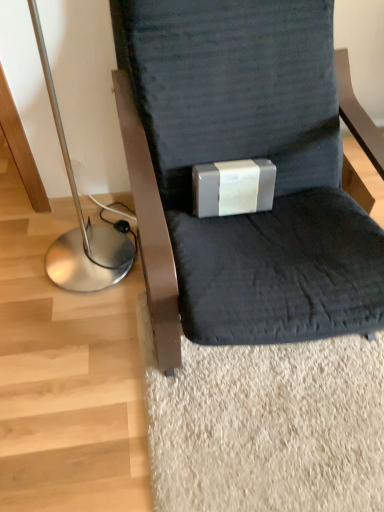
Question: Is matte gray box at center completely or partially outside of silver metallic floor lamp at left?

Choices:
 (A) no
 (B) yes

Answer: (B)

Question: From a real-world perspective, is matte gray box at center physically below silver metallic floor lamp at left?

Choices:
 (A) no
 (B) yes

Answer: (B)

Question: Does matte gray box at center lie in front of silver metallic floor lamp at left?

Choices:
 (A) yes
 (B) no

Answer: (B)

Question: Does matte gray box at center have a greater width compared to silver metallic floor lamp at left?

Choices:
 (A) yes
 (B) no

Answer: (B)

Question: Is matte gray box at center taller than silver metallic floor lamp at left?

Choices:
 (A) yes
 (B) no

Answer: (B)

Question: Considering the relative positions of matte gray box at center and matte gray cushion at center in the image provided, is matte gray box at center to the left or to the right of matte gray cushion at center?

Choices:
 (A) right
 (B) left

Answer: (B)

Question: From a real-world perspective, is matte gray box at center above or below matte gray cushion at center?

Choices:
 (A) below
 (B) above

Answer: (A)

Question: In terms of width, does matte gray box at center look wider or thinner when compared to matte gray cushion at center?

Choices:
 (A) thin
 (B) wide

Answer: (A)

Question: Do you think matte gray box at center is within matte gray cushion at center, or outside of it?

Choices:
 (A) inside
 (B) outside

Answer: (A)

Question: Would you say matte gray cushion at center is to the left or to the right of silver metallic floor lamp at left in the picture?

Choices:
 (A) right
 (B) left

Answer: (A)

Question: Considering their positions, is matte gray cushion at center located in front of or behind silver metallic floor lamp at left?

Choices:
 (A) front
 (B) behind

Answer: (A)

Question: From the image's perspective, is matte gray cushion at center above or below silver metallic floor lamp at left?

Choices:
 (A) above
 (B) below

Answer: (B)

Question: Is matte gray cushion at center situated inside silver metallic floor lamp at left or outside?

Choices:
 (A) outside
 (B) inside

Answer: (A)

Question: Is point (193, 181) positioned closer to the camera than point (107, 280)?

Choices:
 (A) closer
 (B) farther

Answer: (A)

Question: In terms of size, does matte gray box at center appear bigger or smaller than silver metallic floor lamp at left?

Choices:
 (A) big
 (B) small

Answer: (B)